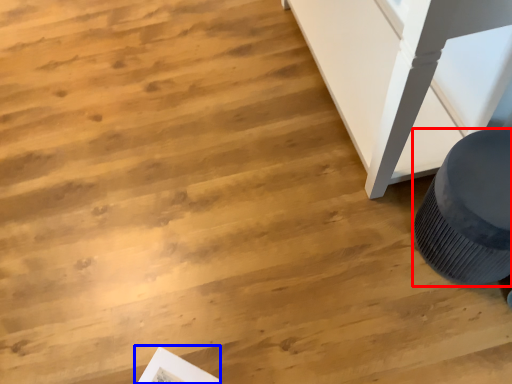
Question: Among these objects, which one is nearest to the camera, furniture (highlighted by a red box) or magazine (highlighted by a blue box)?

Choices:
 (A) furniture
 (B) magazine

Answer: (A)